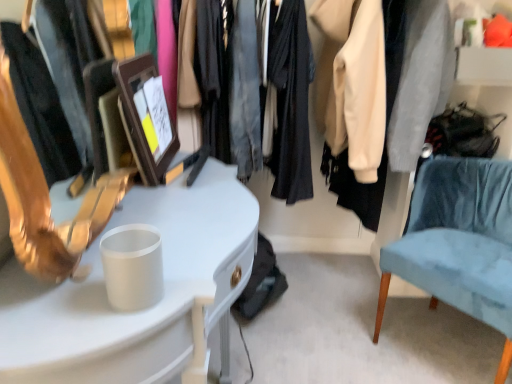
Question: Does point (110, 324) appear closer or farther from the camera than point (436, 198)?

Choices:
 (A) farther
 (B) closer

Answer: (B)

Question: From a real-world perspective, is white glossy desk at left above or below velvet blue chair at right?

Choices:
 (A) below
 (B) above

Answer: (B)

Question: From the image's perspective, is white glossy desk at left positioned above or below velvet blue chair at right?

Choices:
 (A) below
 (B) above

Answer: (A)

Question: Considering the positions of velvet blue chair at right and white glossy desk at left in the image, is velvet blue chair at right bigger or smaller than white glossy desk at left?

Choices:
 (A) small
 (B) big

Answer: (A)

Question: Is velvet blue chair at right spatially inside white glossy desk at left, or outside of it?

Choices:
 (A) outside
 (B) inside

Answer: (A)

Question: Does point (437, 278) appear closer or farther from the camera than point (155, 188)?

Choices:
 (A) closer
 (B) farther

Answer: (B)

Question: From the image's perspective, relative to white glossy desk at left, is velvet blue chair at right above or below?

Choices:
 (A) below
 (B) above

Answer: (B)